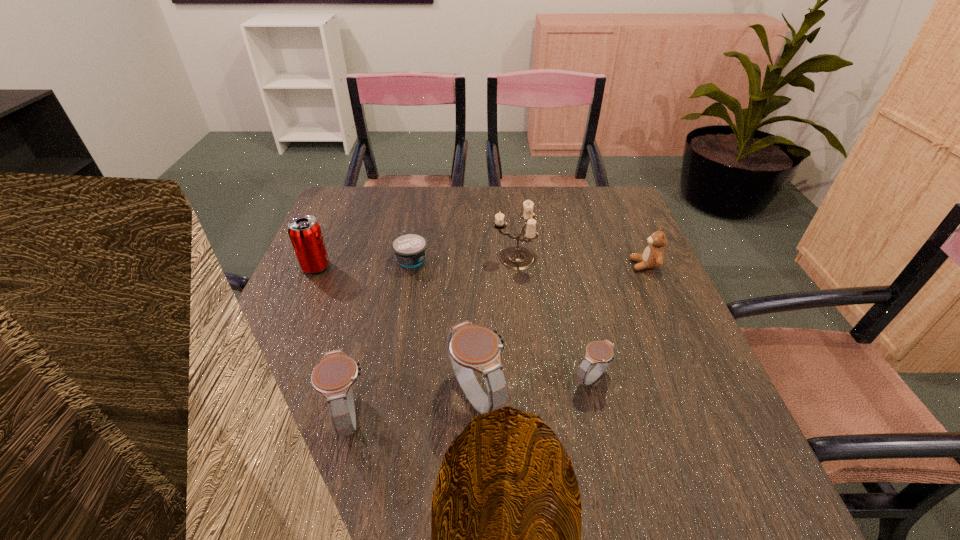
You are a GUI agent. You are given a task and a screenshot of the screen. Output one action in this format:
    pyautogui.click(x=<x>, y=<y>)
    Task: Click on the vacant space located 0.260m on the left of the second watch from left to right
    The width and height of the screenshot is (960, 540).
    Given the screenshot: What is the action you would take?
    pyautogui.click(x=312, y=397)

Image resolution: width=960 pixels, height=540 pixels. I want to click on vacant space located 0.310m on the left of the rightmost watch, so click(x=416, y=379).

This screenshot has width=960, height=540. I want to click on vacant point located on the right of the leftmost object, so click(434, 267).

The image size is (960, 540). In order to click on vacant region located on the front-facing side of the fifth tallest object in this screenshot , I will do `click(539, 265)`.

Where is `vacant space located 0.090m on the front-facing side of the fifth tallest object`? This screenshot has width=960, height=540. vacant space located 0.090m on the front-facing side of the fifth tallest object is located at coordinates (596, 265).

At what (x,y) coordinates should I click in order to perform the action: click on vacant space located 0.270m on the front-facing side of the fifth tallest object. Please return your answer as a coordinate pair (x, y). Looking at the image, I should click on (527, 265).

I want to click on vacant space located on the front of the yogurt, so click(401, 312).

The image size is (960, 540). Identify the location of free spot located 0.320m on the front of the candle holder. (525, 376).

At what (x,y) coordinates should I click in order to perform the action: click on object present at the left edge. Please return your answer as a coordinate pair (x, y). The width and height of the screenshot is (960, 540). Looking at the image, I should click on tap(304, 231).

Identify the location of object present at the right edge. The width and height of the screenshot is (960, 540). (653, 256).